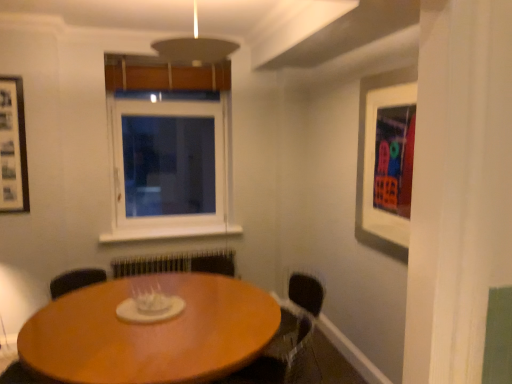
Question: Is the depth of white matte picture frame at upper right, placed as the 1th picture frame when sorted from right to left, less than that of matte black armchair at lower right?

Choices:
 (A) no
 (B) yes

Answer: (B)

Question: Does white matte picture frame at upper right, marked as the second picture frame in a back-to-front arrangement, have a greater width compared to matte black armchair at lower right?

Choices:
 (A) yes
 (B) no

Answer: (B)

Question: Does white matte picture frame at upper right, marked as the second picture frame in a back-to-front arrangement, have a larger size compared to matte black armchair at lower right?

Choices:
 (A) no
 (B) yes

Answer: (A)

Question: Is white matte picture frame at upper right, marked as the second picture frame in a back-to-front arrangement, smaller than matte black armchair at lower right?

Choices:
 (A) no
 (B) yes

Answer: (B)

Question: Is matte black armchair at lower right surrounded by white matte picture frame at upper right, marked as the second picture frame in a back-to-front arrangement?

Choices:
 (A) yes
 (B) no

Answer: (B)

Question: From the image's perspective, is white matte picture frame at upper right, which is the 1th picture frame in front-to-back order, located above matte black armchair at lower right?

Choices:
 (A) no
 (B) yes

Answer: (B)

Question: Would you say black matte picture frame at left, positioned as the first picture frame in left-to-right order, contains wooden table at center?

Choices:
 (A) yes
 (B) no

Answer: (B)

Question: Is black matte picture frame at left, positioned as the first picture frame in left-to-right order, further to the viewer compared to wooden table at center?

Choices:
 (A) yes
 (B) no

Answer: (A)

Question: Can you confirm if black matte picture frame at left, placed as the 2th picture frame when sorted from right to left, is positioned to the left of wooden table at center?

Choices:
 (A) yes
 (B) no

Answer: (A)

Question: Could you tell me if black matte picture frame at left, positioned as the first picture frame in left-to-right order, is turned towards wooden table at center?

Choices:
 (A) no
 (B) yes

Answer: (A)

Question: Is black matte picture frame at left, which is the first picture frame from back to front, far from wooden table at center?

Choices:
 (A) yes
 (B) no

Answer: (A)

Question: From a real-world perspective, is black matte picture frame at left, placed as the 2th picture frame when sorted from right to left, below wooden table at center?

Choices:
 (A) no
 (B) yes

Answer: (A)

Question: From a real-world perspective, is white matte picture frame at upper right, which appears as the 2th picture frame when viewed from the left, under white plastic window at center?

Choices:
 (A) no
 (B) yes

Answer: (A)